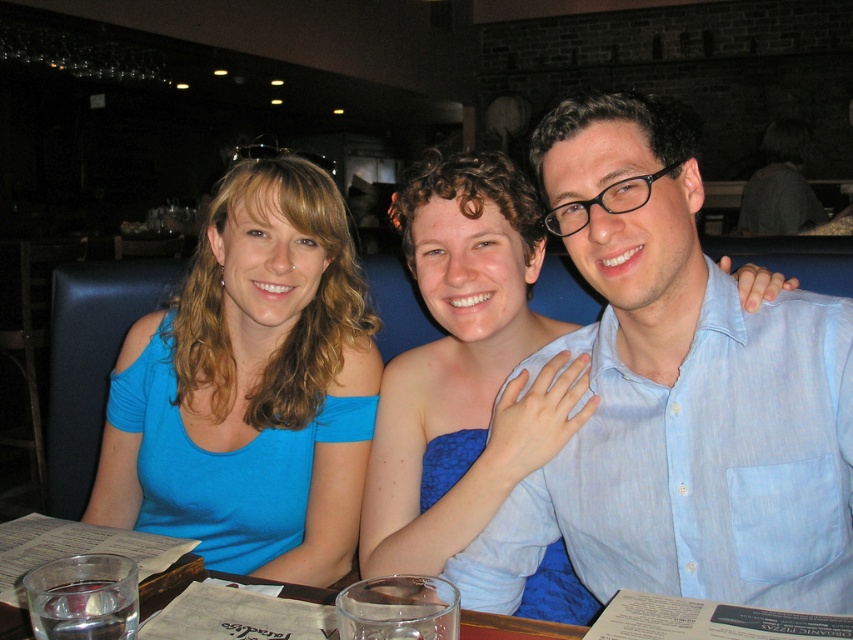
You are a photographer trying to capture a group photo of the light blue shirt at center and the blue cotton shirt at left. Since you want to ensure both shirts are visible in the frame, which shirt should you position closer to the camera to avoid overlapping?

The light blue shirt at center is thinner than blue cotton shirt at left, so you should position the light blue shirt at center closer to the camera to ensure it doesn